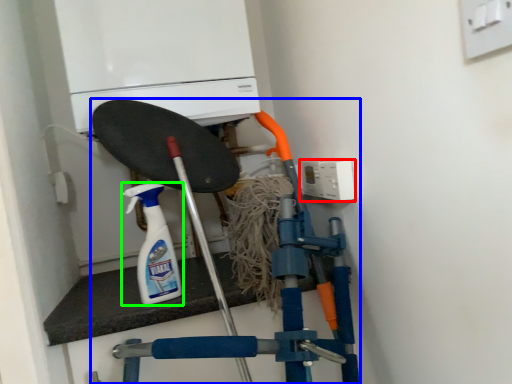
Question: Which is farther away from electric outlet (highlighted by a red box)? vacuum (highlighted by a blue box) or cleaning product (highlighted by a green box)?

Choices:
 (A) vacuum
 (B) cleaning product

Answer: (B)